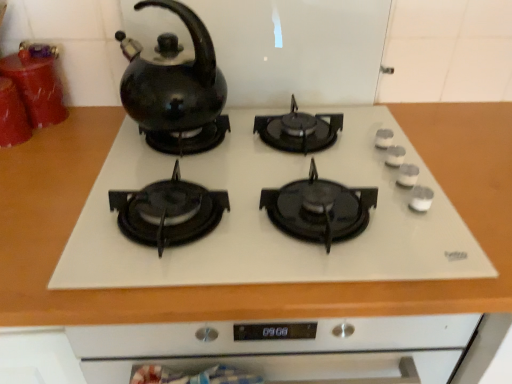
I want to click on unoccupied region to the right of shiny red glass cups at left, the second kitchen appliance positioned from the front, so 93,120.